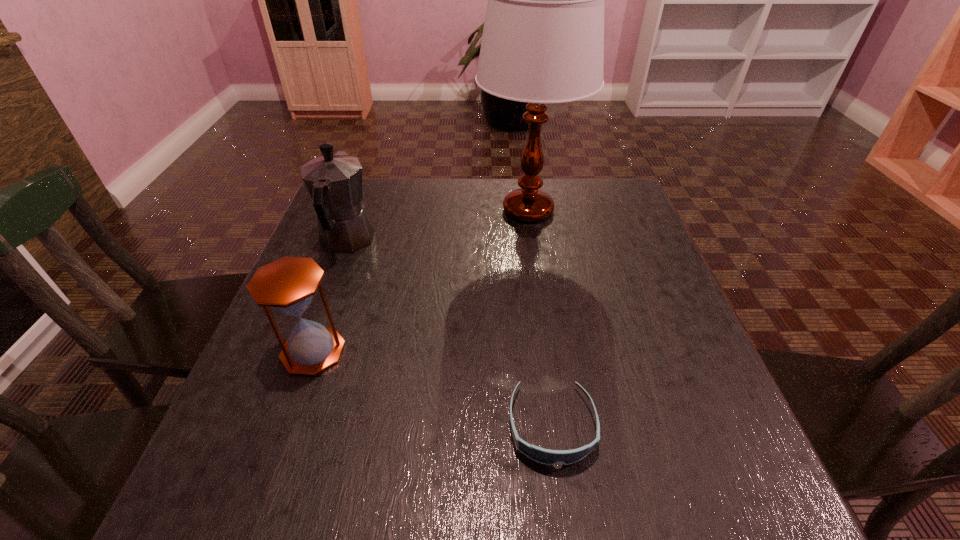
The image size is (960, 540). I want to click on free point between the goggles and the coffeepot, so click(x=449, y=334).

Where is `vacant region between the third tallest object and the shortest object`? vacant region between the third tallest object and the shortest object is located at coordinates (433, 389).

Locate an element on the screen. free area in between the tallest object and the second tallest object is located at coordinates (437, 226).

Identify the location of vacant region between the hourglass and the nearest object. (433, 389).

Find the location of a particular element. The width and height of the screenshot is (960, 540). vacant area between the third tallest object and the coffeepot is located at coordinates point(330,296).

The height and width of the screenshot is (540, 960). Identify the location of free point between the goggles and the second shortest object. (433, 389).

The height and width of the screenshot is (540, 960). I want to click on unoccupied area between the coffeepot and the hourglass, so click(330, 296).

You are a GUI agent. You are given a task and a screenshot of the screen. Output one action in this format:
    pyautogui.click(x=<x>, y=<y>)
    Task: Click on the object that stands as the closest to the second tallest object
    This screenshot has width=960, height=540.
    Given the screenshot: What is the action you would take?
    pyautogui.click(x=288, y=284)

Identify the location of the second closest object to the second nearest object. Image resolution: width=960 pixels, height=540 pixels. (544, 456).

The image size is (960, 540). Identify the location of vacant space that satisfies the following two spatial constraints: 1. on the pouring side of the table lamp; 2. on the left side of the coffeepot. (358, 210).